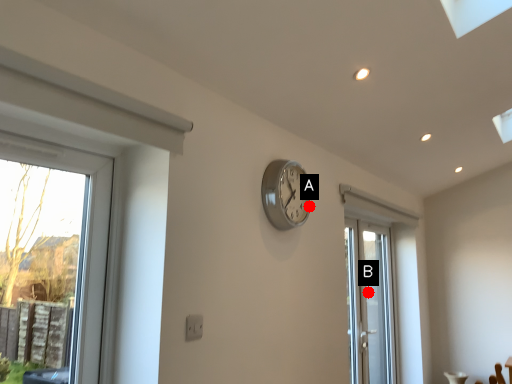
Question: Two points are circled on the image, labeled by A and B beside each circle. Which point appears farthest from the camera in this image?

Choices:
 (A) A is further
 (B) B is further

Answer: (B)